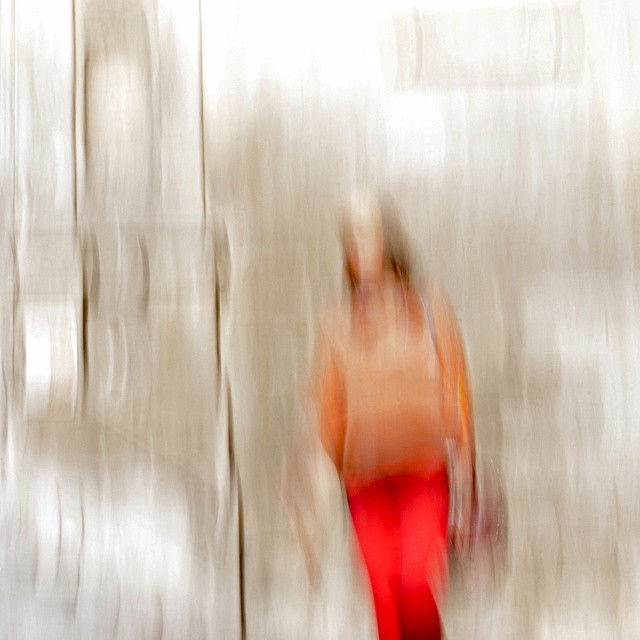
Question: Can you confirm if smooth orange fabric at center is positioned to the right of matte red leggings at center?

Choices:
 (A) no
 (B) yes

Answer: (A)

Question: Which object is farther from the camera taking this photo?

Choices:
 (A) smooth orange fabric at center
 (B) matte red leggings at center

Answer: (A)

Question: Does smooth orange fabric at center lie in front of matte red leggings at center?

Choices:
 (A) no
 (B) yes

Answer: (A)

Question: Which of the following is the closest to the observer?

Choices:
 (A) smooth orange fabric at center
 (B) matte red leggings at center

Answer: (B)

Question: Which object appears closest to the camera in this image?

Choices:
 (A) smooth orange fabric at center
 (B) matte red leggings at center

Answer: (B)

Question: Considering the relative positions of smooth orange fabric at center and matte red leggings at center in the image provided, where is smooth orange fabric at center located with respect to matte red leggings at center?

Choices:
 (A) left
 (B) right

Answer: (A)